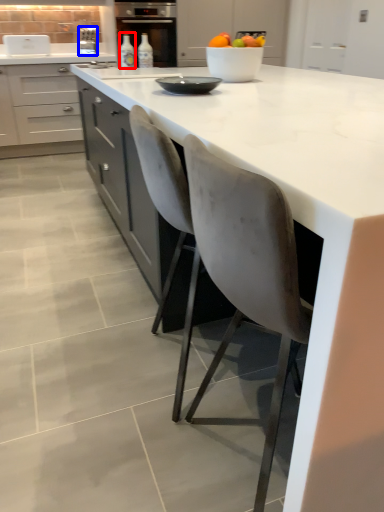
Question: Which object is closer to the camera taking this photo, bottle (highlighted by a red box) or kitchen appliance (highlighted by a blue box)?

Choices:
 (A) bottle
 (B) kitchen appliance

Answer: (A)